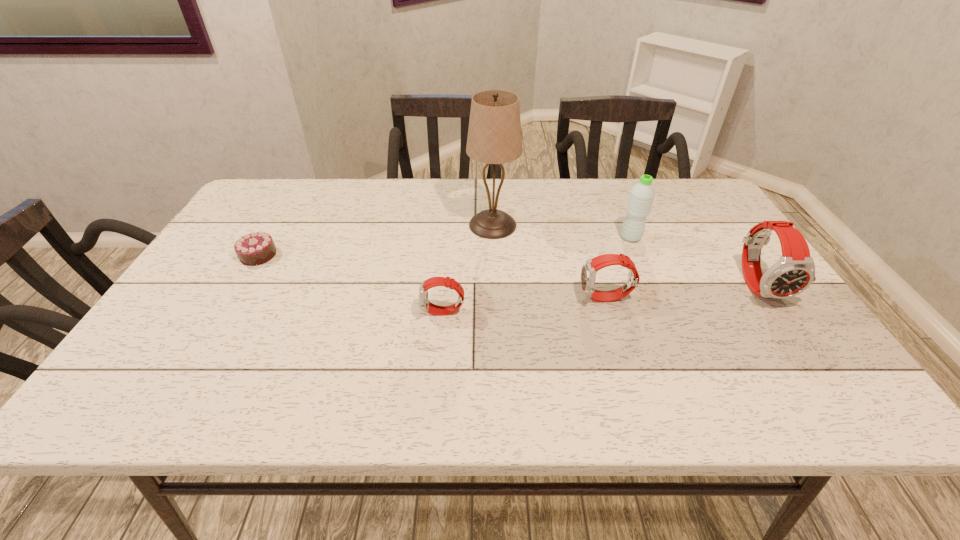
I want to click on free space located 0.140m on the front-facing side of the lampshade, so click(x=420, y=225).

This screenshot has width=960, height=540. I want to click on vacant space located 0.320m on the front-facing side of the lampshade, so click(x=359, y=225).

This screenshot has height=540, width=960. I want to click on object located in the far edge section of the desktop, so click(x=494, y=137).

The height and width of the screenshot is (540, 960). I want to click on object positioned at the left edge, so click(x=257, y=248).

This screenshot has width=960, height=540. I want to click on object at the right edge, so click(794, 272).

Where is `free spot at the far edge of the desktop`? Image resolution: width=960 pixels, height=540 pixels. free spot at the far edge of the desktop is located at coordinates (615, 216).

You are a GUI agent. You are given a task and a screenshot of the screen. Output one action in this format:
    pyautogui.click(x=<x>, y=<y>)
    Task: Click on the blank space at the near edge of the desktop
    Image resolution: width=960 pixels, height=540 pixels.
    Given the screenshot: What is the action you would take?
    pyautogui.click(x=682, y=352)

Find the location of `vacant area at the left edge of the desktop`. vacant area at the left edge of the desktop is located at coordinates (206, 286).

Locate an element on the screen. free space at the far left corner is located at coordinates (268, 202).

The width and height of the screenshot is (960, 540). I want to click on free space at the near left corner of the desktop, so click(221, 339).